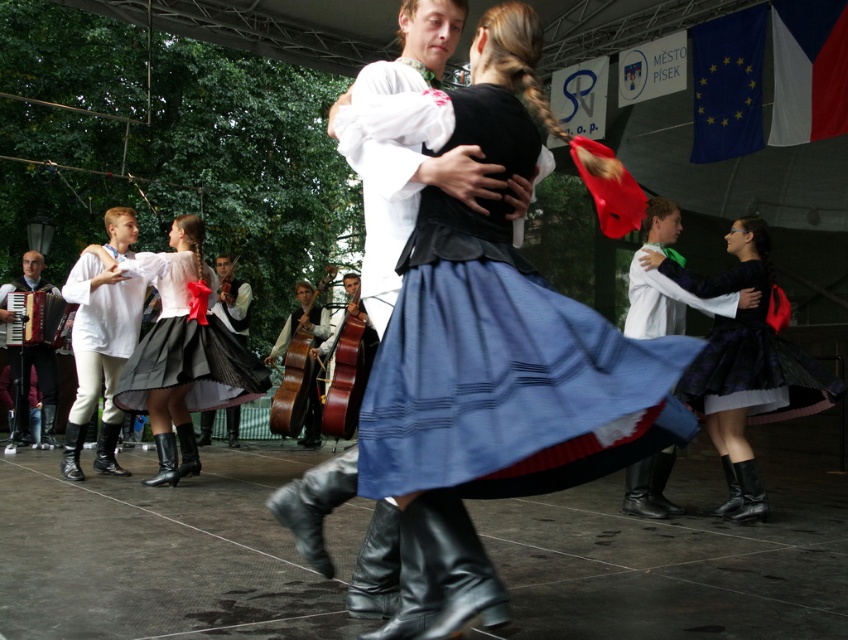
You are setting up a music stand for a performer. The stand requires 1 meter of space. You have to choose between placing it next to the matte white accordion at left or the wooden polished cello at center. Which instrument should you choose to ensure the stand fits?

The matte white accordion at left occupies less space than the wooden polished cello at center, so placing the music stand next to the matte white accordion at left would provide enough space for the stand.

You are a photographer standing in front of the stage where the dance performance is happening. You see the matte white accordion at left and the wooden polished cello at center. Which instrument is closer to the left edge of the stage?

The matte white accordion at left is closer to the left edge of the stage because it is positioned on the left side of the wooden polished cello at center.

You are a photographer standing at the edge of the dance floor, wanting to capture a photo of both the blue cotton skirt at center and the white cotton shirt at left in the same frame. Given that your camera has a maximum focus range of 10 feet, will you be able to include both subjects in the shot?

The distance between the blue cotton skirt at center and the white cotton shirt at left is 12.71 feet, which exceeds the camera maximum focus range of 10 feet. Therefore, you cannot include both subjects in the same frame.